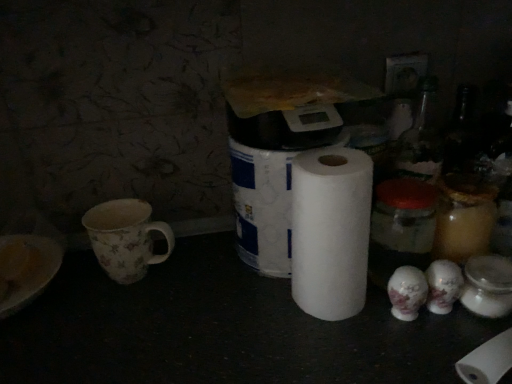
Question: Is white matte paper towel at center not inside white matte toilet paper at center?

Choices:
 (A) yes
 (B) no

Answer: (A)

Question: Is the position of white matte paper towel at center more distant than that of white matte toilet paper at center?

Choices:
 (A) no
 (B) yes

Answer: (A)

Question: Is white matte paper towel at center looking in the opposite direction of white matte toilet paper at center?

Choices:
 (A) yes
 (B) no

Answer: (A)

Question: Considering the relative sizes of white matte paper towel at center and white matte toilet paper at center in the image provided, is white matte paper towel at center taller than white matte toilet paper at center?

Choices:
 (A) yes
 (B) no

Answer: (B)

Question: Considering the relative sizes of white matte paper towel at center and white matte toilet paper at center in the image provided, is white matte paper towel at center bigger than white matte toilet paper at center?

Choices:
 (A) no
 (B) yes

Answer: (A)

Question: From the image's perspective, is floral-patterned ceramic mug at left positioned above or below white matte paper towel at center?

Choices:
 (A) above
 (B) below

Answer: (B)

Question: Do you think floral-patterned ceramic mug at left is within white matte paper towel at center, or outside of it?

Choices:
 (A) inside
 (B) outside

Answer: (B)

Question: Is point (118, 203) closer or farther from the camera than point (324, 258)?

Choices:
 (A) farther
 (B) closer

Answer: (A)

Question: Is floral-patterned ceramic mug at left taller or shorter than white matte paper towel at center?

Choices:
 (A) tall
 (B) short

Answer: (B)

Question: From a real-world perspective, relative to white matte toilet paper at center, is white matte paper towel at center vertically above or below?

Choices:
 (A) above
 (B) below

Answer: (B)

Question: Is point (344, 261) closer or farther from the camera than point (275, 243)?

Choices:
 (A) farther
 (B) closer

Answer: (B)

Question: From the image's perspective, is white matte paper towel at center above or below white matte toilet paper at center?

Choices:
 (A) above
 (B) below

Answer: (B)

Question: Looking at the image, does white matte paper towel at center seem bigger or smaller compared to white matte toilet paper at center?

Choices:
 (A) small
 (B) big

Answer: (A)

Question: In terms of height, does white matte toilet paper at center look taller or shorter compared to white matte paper towel at center?

Choices:
 (A) tall
 (B) short

Answer: (A)

Question: Choose the correct answer: Is white matte toilet paper at center inside white matte paper towel at center or outside it?

Choices:
 (A) inside
 (B) outside

Answer: (B)